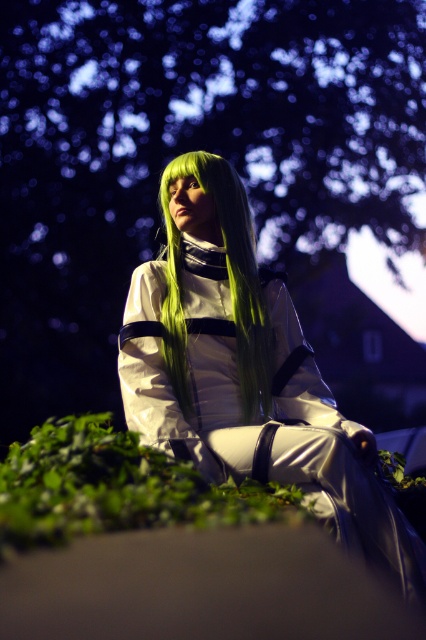
Question: Which of the following is the farthest from the observer?

Choices:
 (A) satin green wig at center
 (B) green silky wig at center

Answer: (B)

Question: Does satin green wig at center have a greater width compared to green silky wig at center?

Choices:
 (A) yes
 (B) no

Answer: (A)

Question: Which point appears closest to the camera in this image?

Choices:
 (A) (193, 216)
 (B) (190, 212)
 (C) (23, 397)

Answer: (B)

Question: Among these points, which one is nearest to the camera?

Choices:
 (A) (265, 408)
 (B) (19, 136)

Answer: (A)

Question: Considering the relative positions of green leafy tree at upper center and satin green wig at center in the image provided, where is green leafy tree at upper center located with respect to satin green wig at center?

Choices:
 (A) right
 (B) left

Answer: (B)

Question: Can you confirm if satin green wig at center is positioned to the left of green silky wig at center?

Choices:
 (A) no
 (B) yes

Answer: (A)